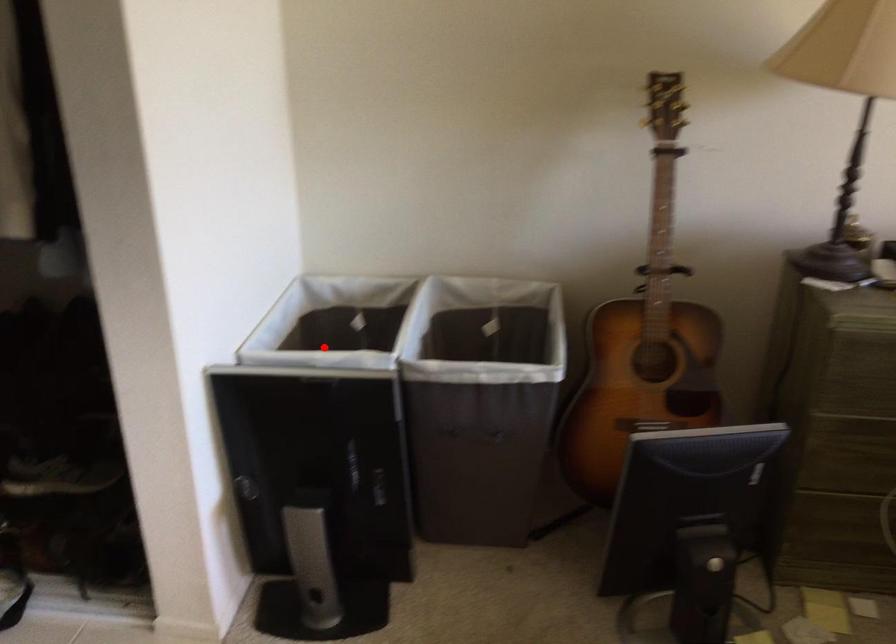
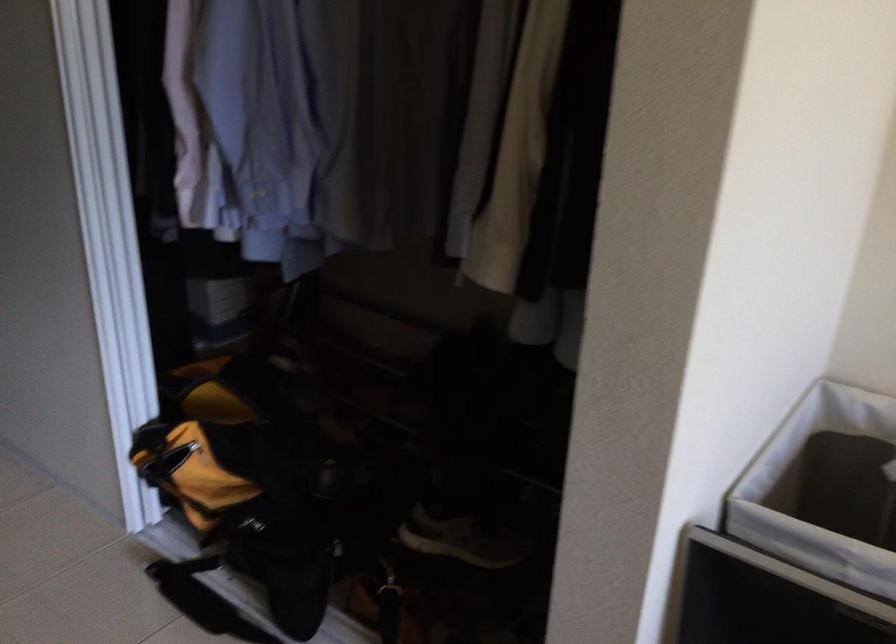
Question: I am providing you with two images of the same scene from different viewpoints. Given a red point in image1, look at the same physical point in image2. Is it:

Choices:
 (A) Closer to the viewpoint
 (B) Farther from the viewpoint

Answer: (A)